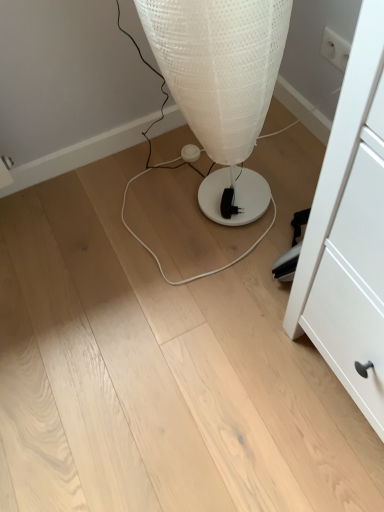
Locate an element on the screen. vacant space to the left of white matte lamp at center is located at coordinates (130, 216).